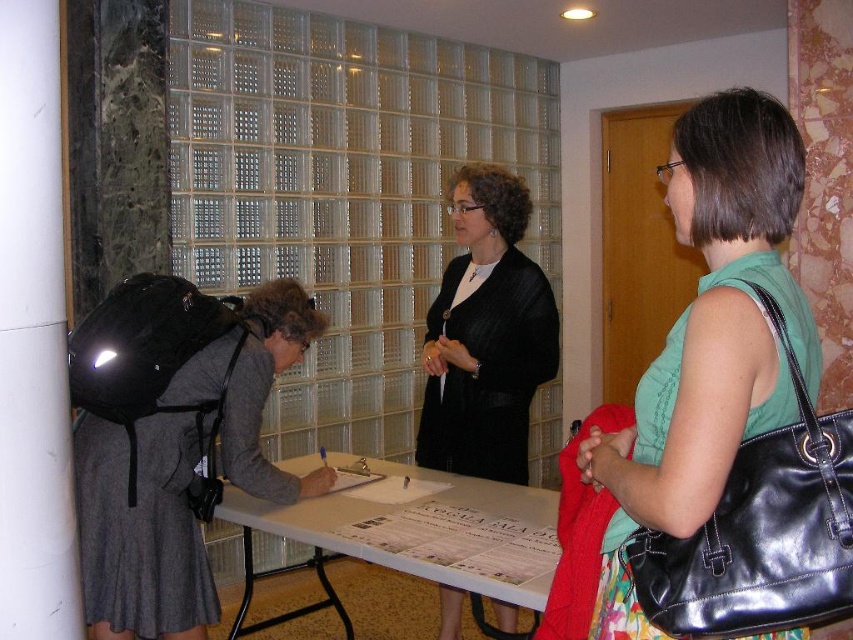
You are standing at the center of the room and want to move towards the white smooth pillar at left. Which direction should you move?

Since the white smooth pillar at left is located at point [33,337], you should move to the left to reach it.

You are a photographer positioned behind the green fabric shirt at right and the black textured blazer at center. Which person should you focus on first to capture both in the frame?

You should focus on the green fabric shirt at right first because it is closer to you than the black textured blazer at center, allowing both to be in the frame.